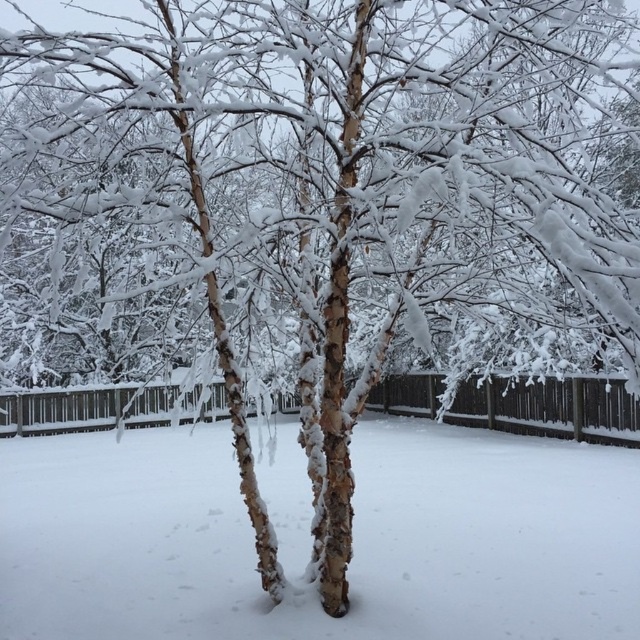
Looking at this image, is white textured snow at center wider than brown wooden fence at center?

Incorrect, white textured snow at center's width does not surpass brown wooden fence at center's.

Does white textured snow at center have a lesser width compared to brown wooden fence at center?

Yes, white textured snow at center is thinner than brown wooden fence at center.

Where is `white textured snow at center`? Image resolution: width=640 pixels, height=640 pixels. white textured snow at center is located at coordinates (353, 538).

In order to click on white textured snow at center in this screenshot , I will do `click(353, 538)`.